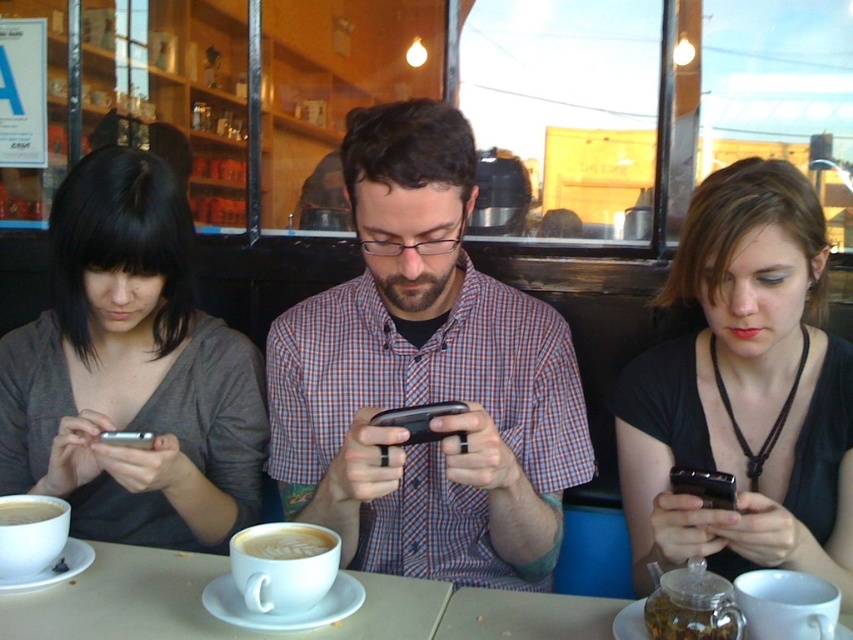
In the scene shown: You are a barista trying to place a small saucer between the plaid shirt at center and the black matte phone at center on the table. Can you fit it there?

The plaid shirt at center might be wider than the black matte phone at center, so there may not be enough space to fit the saucer between them.

You are a barista who needs to deliver a cup of coffee to the table where the white frothy coffee at center is located. You are currently standing 1.0 meters away from the table. Can you reach the table to place the coffee without moving closer?

The white frothy coffee at center and the viewer are 1.01 meters apart. Since you are standing 1.0 meters away from the table, you are slightly closer than the distance specified, so you can comfortably reach the table to place the coffee without needing to move closer.

You are a barista who needs to place a new coffee cup between the plaid shirt at center and the black matte phone at center. The cup has a diameter of 8 centimeters. Can you fit it there without moving either the shirt or the phone?

The distance between the plaid shirt at center and the black matte phone at center is 29.89 centimeters. Since the coffee cup requires only 8 centimeters of space, there is enough room to place it between them without moving either object.